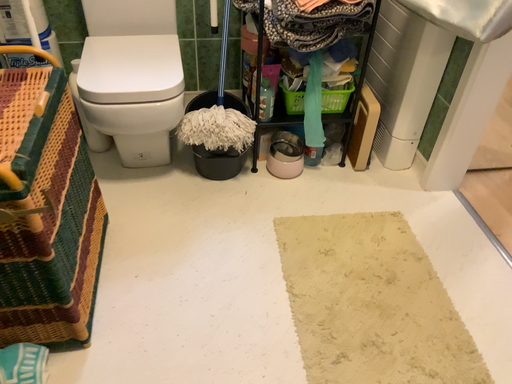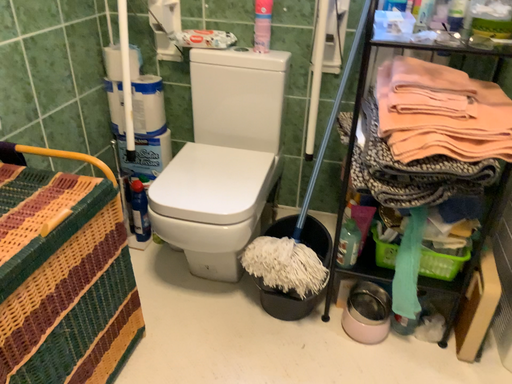
Question: Which way did the camera rotate in the video?

Choices:
 (A) rotated right
 (B) rotated left

Answer: (B)